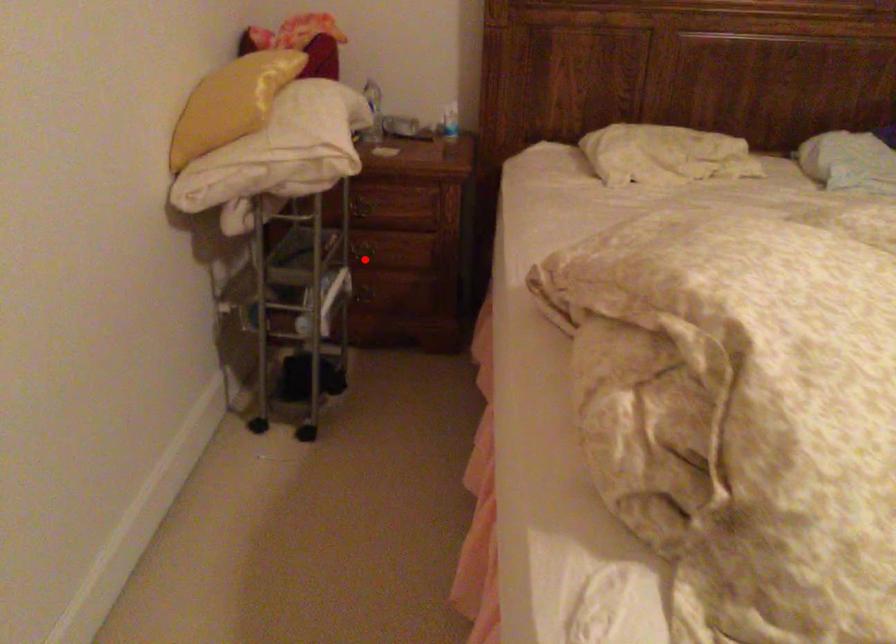
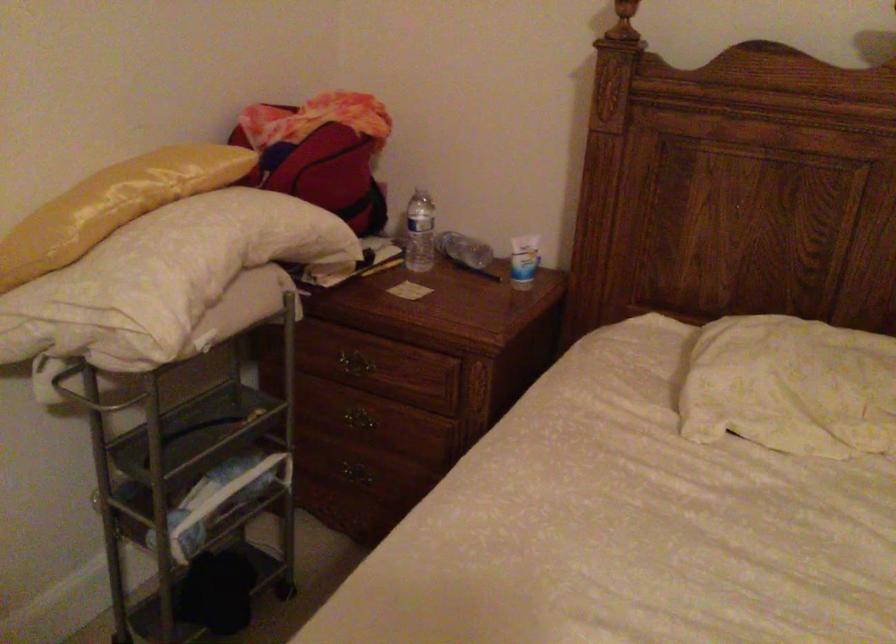
Find the pixel in the second image that matches the highlighted location in the first image.

(357, 426)